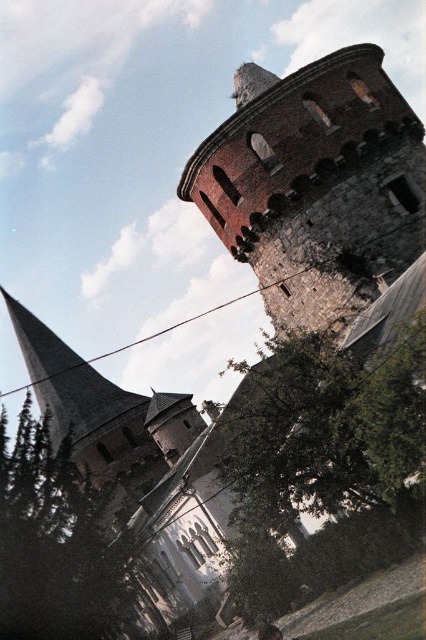
Question: Among these points, which one is nearest to the camera?

Choices:
 (A) (411, 449)
 (B) (374, 236)

Answer: (A)

Question: Which point is closer to the camera taking this photo?

Choices:
 (A) (302, 292)
 (B) (71, 552)
 (C) (382, 403)

Answer: (C)

Question: Is green leafy tree at center to the right of green textured tree at lower left from the viewer's perspective?

Choices:
 (A) no
 (B) yes

Answer: (B)

Question: Does rustic stone spire at upper right appear over green leafy tree at center?

Choices:
 (A) no
 (B) yes

Answer: (B)

Question: Does rustic stone spire at upper right appear under green textured tree at lower left?

Choices:
 (A) yes
 (B) no

Answer: (B)

Question: Which point is closer to the camera?

Choices:
 (A) (98, 618)
 (B) (333, 202)

Answer: (A)